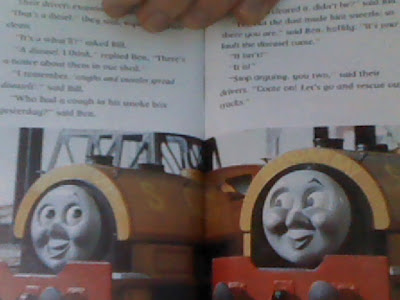
Where is `column`? column is located at coordinates (30, 153).